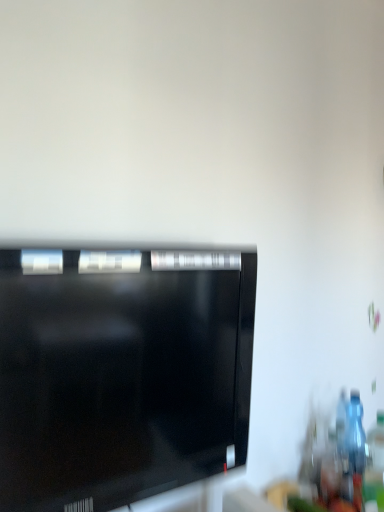
Describe the element at coordinates (121, 372) in the screenshot. Image resolution: width=384 pixels, height=512 pixels. I see `black glossy television at center` at that location.

Find the location of `black glossy television at center`. black glossy television at center is located at coordinates (121, 372).

Locate an element on the screen. transparent plastic bottle at right is located at coordinates (355, 434).

What do you see at coordinates (355, 434) in the screenshot?
I see `transparent plastic bottle at right` at bounding box center [355, 434].

I want to click on black glossy television at center, so click(x=121, y=372).

Considering the relative positions of black glossy television at center and transparent plastic bottle at right in the image provided, is black glossy television at center to the right of transparent plastic bottle at right from the viewer's perspective?

No, black glossy television at center is not to the right of transparent plastic bottle at right.

From the picture: Is the position of black glossy television at center less distant than that of transparent plastic bottle at right?

Yes, black glossy television at center is closer to the camera.

Which is closer to the camera, (95, 398) or (359, 454)?

Clearly, point (95, 398) is closer to the camera than point (359, 454).

From the image's perspective, would you say black glossy television at center is positioned over transparent plastic bottle at right?

Yes.

From a real-world perspective, who is located lower, black glossy television at center or transparent plastic bottle at right?

In real-world perspective, transparent plastic bottle at right is lower.

From the picture: Considering the sizes of objects black glossy television at center and transparent plastic bottle at right in the image provided, who is thinner, black glossy television at center or transparent plastic bottle at right?

Thinner between the two is transparent plastic bottle at right.

Looking at this image, who is shorter, black glossy television at center or transparent plastic bottle at right?

With less height is transparent plastic bottle at right.

Is black glossy television at center bigger than transparent plastic bottle at right?

Correct, black glossy television at center is larger in size than transparent plastic bottle at right.

Would you say transparent plastic bottle at right is part of black glossy television at center's contents?

No.

Is there a large distance between black glossy television at center and transparent plastic bottle at right?

black glossy television at center is actually quite close to transparent plastic bottle at right.

Is black glossy television at center looking in the opposite direction of transparent plastic bottle at right?

No, black glossy television at center's orientation is not away from transparent plastic bottle at right.

Can you tell me how much black glossy television at center and transparent plastic bottle at right differ in facing direction?

The angle between the facing direction of black glossy television at center and the facing direction of transparent plastic bottle at right is 6.59 degrees.

Where is `television on the left of transparent plastic bottle at right`? television on the left of transparent plastic bottle at right is located at coordinates 121,372.

Considering the relative positions of transparent plastic bottle at right and black glossy television at center in the image provided, is transparent plastic bottle at right to the left of black glossy television at center from the viewer's perspective?

No.

Between transparent plastic bottle at right and black glossy television at center, which one is positioned in front?

black glossy television at center is in front.

Which point is more distant from viewer, (346,447) or (221,375)?

Positioned behind is point (346,447).

From the image's perspective, which one is positioned higher, transparent plastic bottle at right or black glossy television at center?

black glossy television at center is shown above in the image.

From a real-world perspective, which is physically above, transparent plastic bottle at right or black glossy television at center?

From a 3D spatial view, black glossy television at center is above.

From the picture: Considering the relative sizes of transparent plastic bottle at right and black glossy television at center in the image provided, is transparent plastic bottle at right thinner than black glossy television at center?

Yes, transparent plastic bottle at right is thinner than black glossy television at center.

Considering the sizes of objects transparent plastic bottle at right and black glossy television at center in the image provided, who is shorter, transparent plastic bottle at right or black glossy television at center?

With less height is transparent plastic bottle at right.

Looking at the image, does transparent plastic bottle at right seem bigger or smaller compared to black glossy television at center?

Clearly, transparent plastic bottle at right is smaller in size than black glossy television at center.

Is transparent plastic bottle at right situated inside black glossy television at center or outside?

transparent plastic bottle at right is outside black glossy television at center.

Are transparent plastic bottle at right and black glossy television at center making contact?

transparent plastic bottle at right and black glossy television at center are clearly separated.

Is transparent plastic bottle at right turned away from black glossy television at center?

No, black glossy television at center is not at the back of transparent plastic bottle at right.

How many degrees apart are the facing directions of transparent plastic bottle at right and black glossy television at center?

The angular difference between transparent plastic bottle at right and black glossy television at center is 6.59 degrees.

How far apart are transparent plastic bottle at right and black glossy television at center?

They are 34.18 inches apart.

I want to click on bottle that is below the black glossy television at center (from the image's perspective), so click(x=355, y=434).

The height and width of the screenshot is (512, 384). Identify the location of bottle on the right of black glossy television at center. (355, 434).

This screenshot has height=512, width=384. In the image, there is a transparent plastic bottle at right. Find the location of `television above it (from the image's perspective)`. television above it (from the image's perspective) is located at coordinates (121, 372).